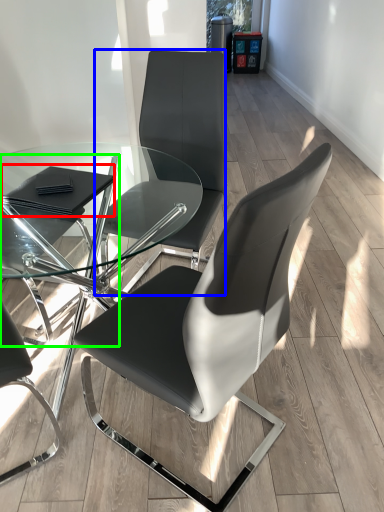
Question: Estimate the real-world distances between objects in this image. Which object is closer to pad (highlighted by a red box), chair (highlighted by a blue box) or chair (highlighted by a green box)?

Choices:
 (A) chair
 (B) chair

Answer: (B)